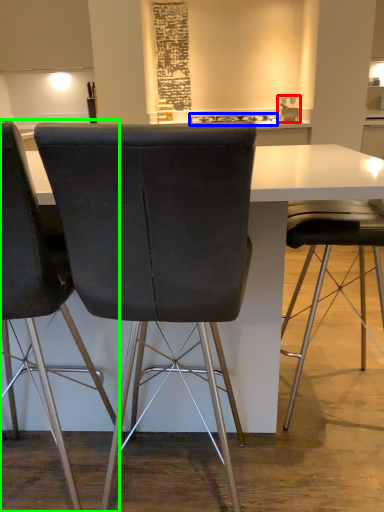
Question: Considering the real-world distances, which object is farthest from sink (highlighted by a red box)? appliance (highlighted by a blue box) or chair (highlighted by a green box)?

Choices:
 (A) appliance
 (B) chair

Answer: (B)